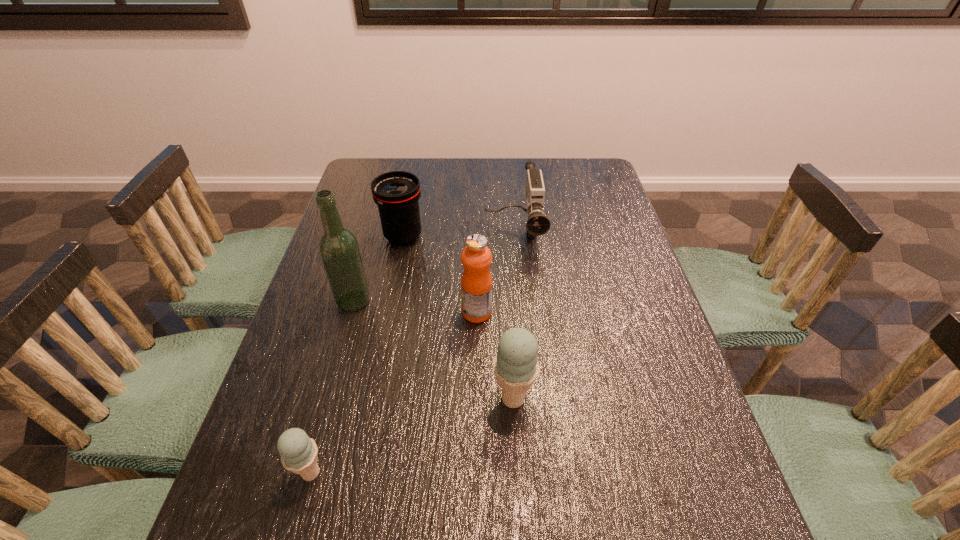
With all ice creams evenly spaced, where should an extra ice cream be placed on the right to continue the pattern? Please point out a vacant space. Please provide its 2D coordinates. Your answer should be formatted as a tuple, i.e. [(x, y)], where the tuple contains the x and y coordinates of a point satisfying the conditions above.

[(672, 340)]